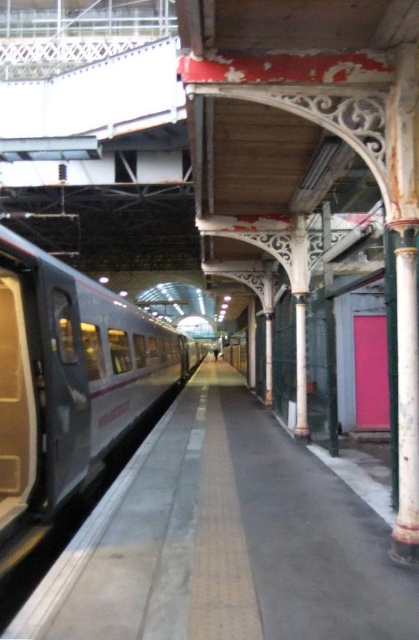
Which of these two, smooth gray platform at center or silver metallic train at left, stands taller?

silver metallic train at left is taller.

Does smooth gray platform at center have a smaller size compared to silver metallic train at left?

Correct, smooth gray platform at center occupies less space than silver metallic train at left.

What do you see at coordinates (224, 540) in the screenshot? Image resolution: width=419 pixels, height=640 pixels. I see `smooth gray platform at center` at bounding box center [224, 540].

Locate an element on the screen. The height and width of the screenshot is (640, 419). smooth gray platform at center is located at coordinates (224, 540).